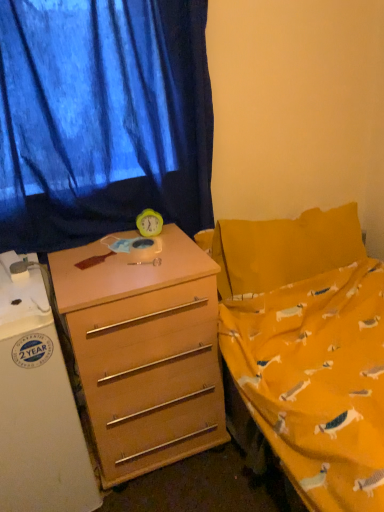
Question: In terms of size, does yellow plastic clock at center appear bigger or smaller than blue fabric curtain at upper left?

Choices:
 (A) small
 (B) big

Answer: (A)

Question: Is yellow plastic clock at center inside or outside of blue fabric curtain at upper left?

Choices:
 (A) outside
 (B) inside

Answer: (A)

Question: Based on their relative distances, which object is nearer to the yellow plastic clock at center?

Choices:
 (A) white glossy refrigerator at left
 (B) light brown wood desk at center
 (C) blue fabric curtain at upper left

Answer: (C)

Question: Which object is the closest to the white glossy refrigerator at left?

Choices:
 (A) yellow plastic clock at center
 (B) light brown wood desk at center
 (C) blue fabric curtain at upper left

Answer: (B)